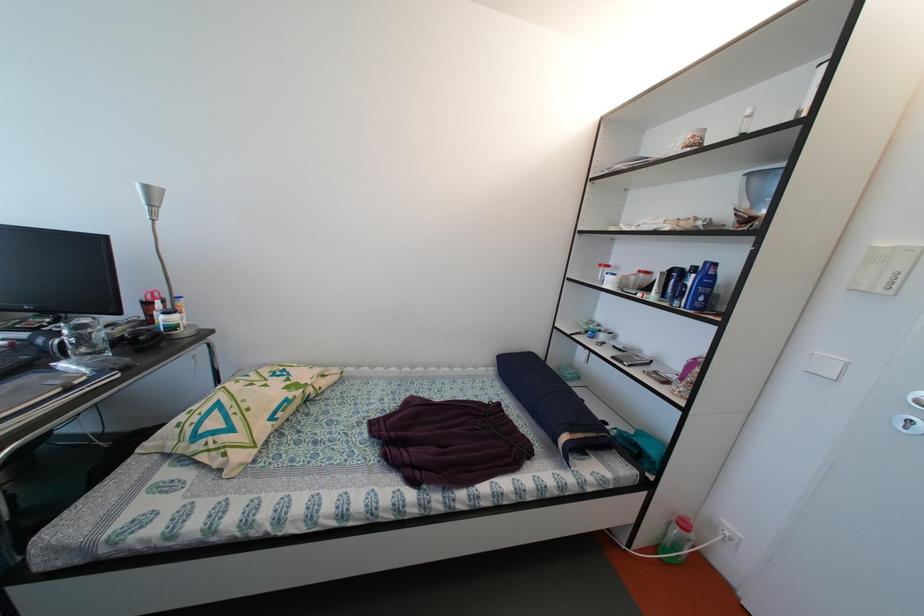
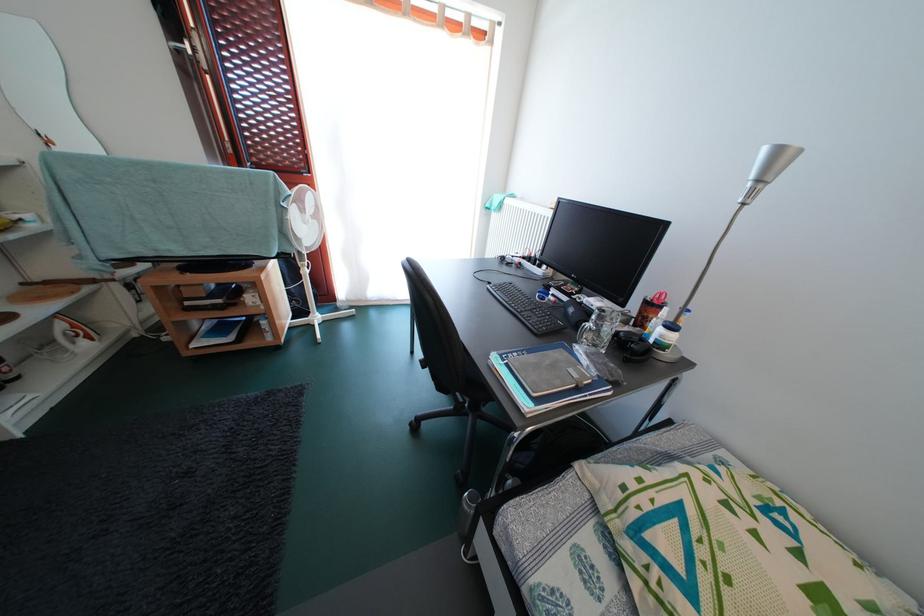
In the second image, find the point that corresponds to [157,326] in the first image.

(648, 328)